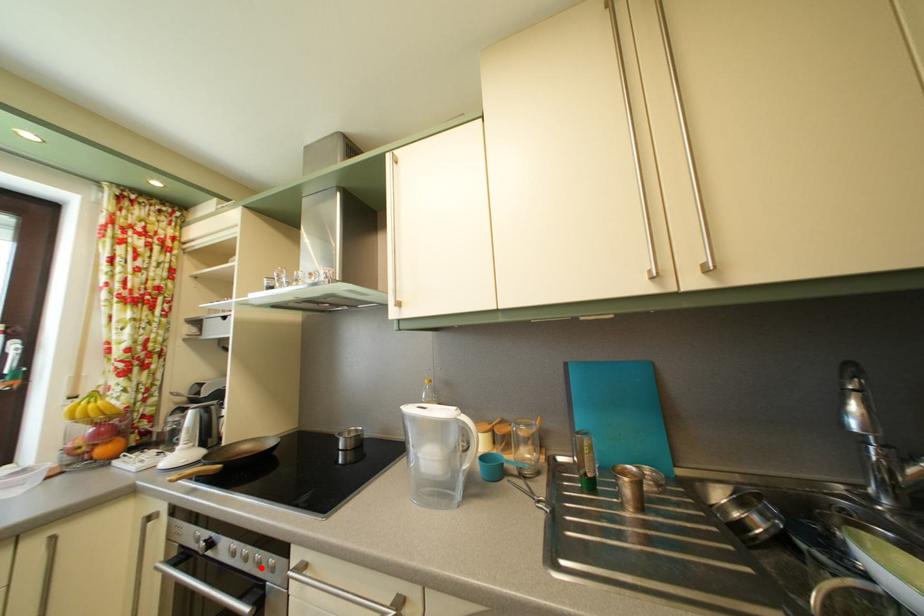
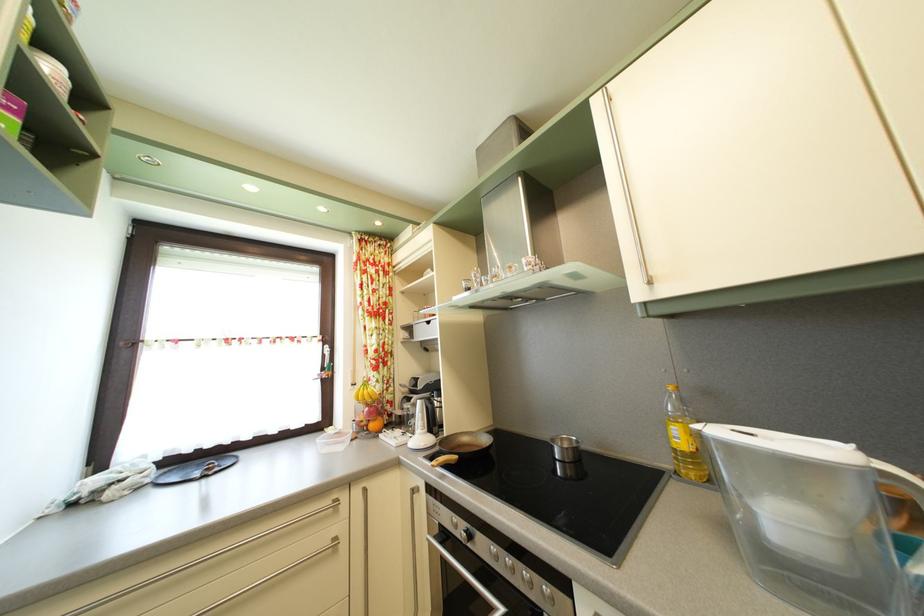
Where in the second image is the point corresponding to the highlighted location from the first image?

(529, 584)